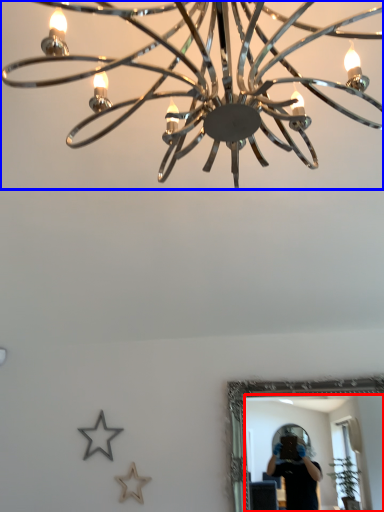
Question: Which point is further to the camera, mirror (highlighted by a red box) or lamp (highlighted by a blue box)?

Choices:
 (A) mirror
 (B) lamp

Answer: (A)